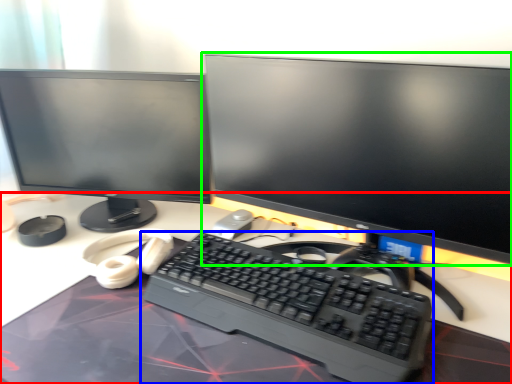
Question: Which is nearer to the desk (highlighted by a red box)? computer keyboard (highlighted by a blue box) or computer monitor (highlighted by a green box).

Choices:
 (A) computer keyboard
 (B) computer monitor

Answer: (A)